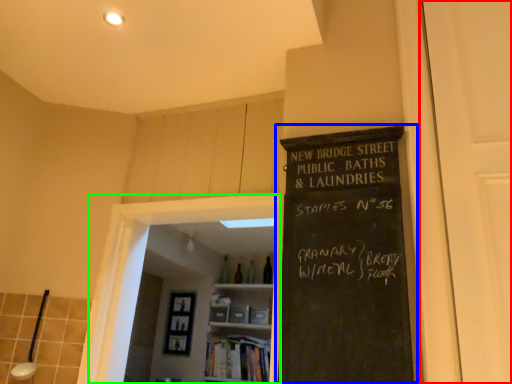
Question: Based on their relative distances, which object is farther from glass door (highlighted by a red box)? Choose from bulletin board (highlighted by a blue box) and glass door (highlighted by a green box).

Choices:
 (A) bulletin board
 (B) glass door

Answer: (B)